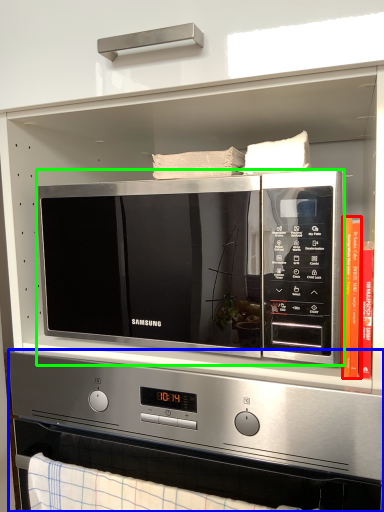
Question: Based on their relative distances, which object is nearer to book (highlighted by a red box)? Choose from appliance (highlighted by a blue box) and microwave oven (highlighted by a green box).

Choices:
 (A) appliance
 (B) microwave oven

Answer: (B)